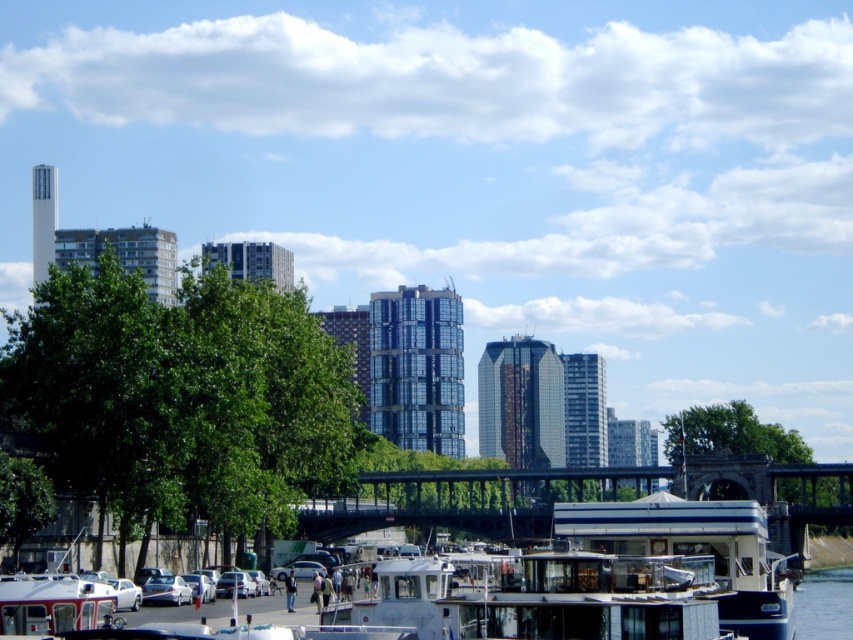
Who is lower down, white glossy houseboat at lower center or green leafy tree at center?

green leafy tree at center is lower down.

Is white glossy houseboat at lower center to the left of green leafy tree at center from the viewer's perspective?

Yes, white glossy houseboat at lower center is to the left of green leafy tree at center.

Between point (737, 548) and point (726, 442), which one is positioned in front?

Point (737, 548) is more forward.

What are the coordinates of `white glossy houseboat at lower center` in the screenshot? It's located at (695, 548).

Is green leafy tree at center taller than green leafy tree at lower left?

Yes, green leafy tree at center is taller than green leafy tree at lower left.

Based on the photo, can you confirm if green leafy tree at center is positioned to the right of green leafy tree at lower left?

Correct, you'll find green leafy tree at center to the right of green leafy tree at lower left.

Which is in front, point (747, 404) or point (16, 531)?

Positioned in front is point (16, 531).

Where is `green leafy tree at center`? green leafy tree at center is located at coordinates (740, 433).

Can you confirm if transparent glass cabin at lower center is bigger than white glossy houseboat at lower center?

No.

Who is more forward, (573, 628) or (576, 506)?

Point (573, 628) is in front.

I want to click on transparent glass cabin at lower center, so click(596, 600).